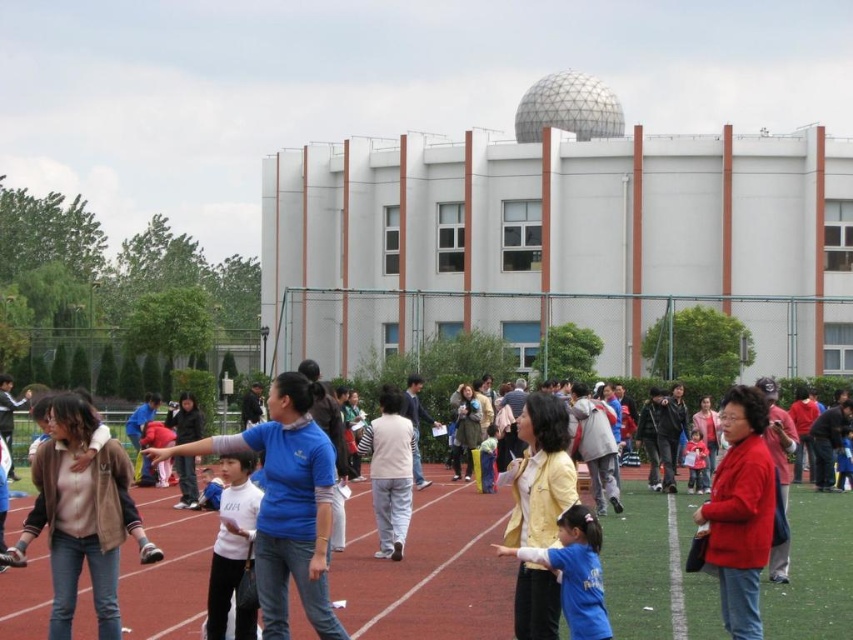
Who is shorter, brown suede jacket at lower left or blue denim pants at center?

blue denim pants at center is shorter.

Can you confirm if brown suede jacket at lower left is bigger than blue denim pants at center?

Correct, brown suede jacket at lower left is larger in size than blue denim pants at center.

Is point (105, 480) positioned before point (494, 461)?

Yes.

I want to click on brown suede jacket at lower left, so click(82, 515).

Does blue fabric shirt at center have a greater width compared to matte pink shirt at center?

No, blue fabric shirt at center is not wider than matte pink shirt at center.

Which of these two, blue fabric shirt at center or matte pink shirt at center, stands shorter?

blue fabric shirt at center is shorter.

Locate an element on the screen. blue fabric shirt at center is located at coordinates (573, 572).

Is white matte shirt at center above blue denim pants at center?

Yes, white matte shirt at center is above blue denim pants at center.

This screenshot has height=640, width=853. Describe the element at coordinates (231, 548) in the screenshot. I see `white matte shirt at center` at that location.

Image resolution: width=853 pixels, height=640 pixels. What do you see at coordinates (231, 548) in the screenshot?
I see `white matte shirt at center` at bounding box center [231, 548].

Where is `white matte shirt at center`? white matte shirt at center is located at coordinates (231, 548).